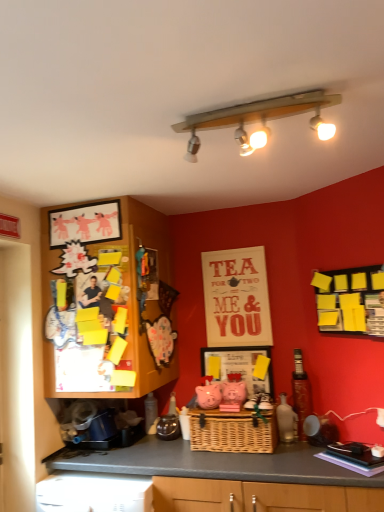
Locate an element on the screen. The height and width of the screenshot is (512, 384). yellow sticky notes at upper right is located at coordinates (351, 300).

Where is `wooden cabinet at left`? Image resolution: width=384 pixels, height=512 pixels. wooden cabinet at left is located at coordinates (106, 302).

Identify the location of woven brown basket at center. (232, 431).

Would you say wooden picture frame at upper left, which appears as the 1th picture frame when viewed from the top, is to the left or to the right of matte white picture frame at center, which ranks as the 2th picture frame in top-to-bottom order, in the picture?

wooden picture frame at upper left, which appears as the 1th picture frame when viewed from the top, is to the left of matte white picture frame at center, which ranks as the 2th picture frame in top-to-bottom order.

From their relative heights in the image, would you say wooden picture frame at upper left, which is the 2th picture frame from bottom to top, is taller or shorter than matte white picture frame at center, which is counted as the 1th picture frame, starting from the right?

In the image, wooden picture frame at upper left, which is the 2th picture frame from bottom to top, appears to be shorter than matte white picture frame at center, which is counted as the 1th picture frame, starting from the right.

Is wooden picture frame at upper left, acting as the first picture frame starting from the front, looking in the opposite direction of matte white picture frame at center, which ranks as the 2th picture frame in top-to-bottom order?

No, wooden picture frame at upper left, acting as the first picture frame starting from the front, is not facing away from matte white picture frame at center, which ranks as the 2th picture frame in top-to-bottom order.

Is woven brown basket at center far away from white plastic dishwasher at lower left?

No, woven brown basket at center is in close proximity to white plastic dishwasher at lower left.

Considering the relative sizes of woven brown basket at center and white plastic dishwasher at lower left in the image provided, is woven brown basket at center shorter than white plastic dishwasher at lower left?

Indeed, woven brown basket at center has a lesser height compared to white plastic dishwasher at lower left.

From a real-world perspective, between woven brown basket at center and white plastic dishwasher at lower left, who is vertically higher?

woven brown basket at center.

Can you confirm if woven brown basket at center is bigger than white plastic dishwasher at lower left?

No, woven brown basket at center is not bigger than white plastic dishwasher at lower left.

Which of these two, woven brown basket at center or shiny metallic bottle at right, is wider?

woven brown basket at center.

Is woven brown basket at center not inside shiny metallic bottle at right?

woven brown basket at center is positioned outside shiny metallic bottle at right.

How distant is woven brown basket at center from shiny metallic bottle at right?

The distance of woven brown basket at center from shiny metallic bottle at right is 13.74 inches.

Based on their positions, is woven brown basket at center located to the left or right of shiny metallic bottle at right?

Clearly, woven brown basket at center is on the left of shiny metallic bottle at right in the image.

Which object is closer to the camera, shiny metallic bottle at right or wooden cabinet at left?

wooden cabinet at left.

From a real-world perspective, is shiny metallic bottle at right above or below wooden cabinet at left?

shiny metallic bottle at right is situated lower than wooden cabinet at left in the real world.

Can wooden cabinet at left be found inside shiny metallic bottle at right?

Actually, wooden cabinet at left is outside shiny metallic bottle at right.

From the image's perspective, which one is positioned higher, shiny metallic bottle at right or wooden cabinet at left?

From the image's view, wooden cabinet at left is above.

Between wooden picture frame at upper left, the 2th picture frame from the back, and white plastic dishwasher at lower left, which one has smaller width?

wooden picture frame at upper left, the 2th picture frame from the back.

Which is less distant, (84, 208) or (93, 482)?

The point (93, 482) is closer.

Find the location of `the 2nd picture frame positioned above the white plastic dishwasher at lower left (from the image's perspective)`. the 2nd picture frame positioned above the white plastic dishwasher at lower left (from the image's perspective) is located at coordinates (85, 223).

From the image's perspective, who appears lower, woven brown basket at center or matte white picture frame at center, which appears as the first picture frame when viewed from the back?

woven brown basket at center, from the image's perspective.

Is matte white picture frame at center, which is counted as the 1th picture frame, starting from the right, at the back of woven brown basket at center?

That's not correct — woven brown basket at center is not looking away from matte white picture frame at center, which is counted as the 1th picture frame, starting from the right.

Which object is closer to the camera, woven brown basket at center or matte white picture frame at center, which is counted as the 1th picture frame, starting from the right?

woven brown basket at center.

How different are the orientations of matte white picture frame at center, which is counted as the 1th picture frame, starting from the right, and woven brown basket at center in degrees?

0.254 degrees separate the facing orientations of matte white picture frame at center, which is counted as the 1th picture frame, starting from the right, and woven brown basket at center.

Is matte white picture frame at center, arranged as the first picture frame when ordered from the bottom, wider or thinner than woven brown basket at center?

matte white picture frame at center, arranged as the first picture frame when ordered from the bottom, is thinner than woven brown basket at center.

Is matte white picture frame at center, which is counted as the 1th picture frame, starting from the right, inside the boundaries of woven brown basket at center, or outside?

matte white picture frame at center, which is counted as the 1th picture frame, starting from the right, lies outside woven brown basket at center.

In the scene shown: Measure the distance between matte white picture frame at center, which appears as the first picture frame when viewed from the back, and woven brown basket at center.

They are 11.63 inches apart.

You are a GUI agent. You are given a task and a screenshot of the screen. Output one action in this format:
    pyautogui.click(x=<x>, y=<y>)
    Task: Click on the picture frame in front of the matte white picture frame at center, which appears as the first picture frame when viewed from the back
    The image size is (384, 512).
    Given the screenshot: What is the action you would take?
    pyautogui.click(x=85, y=223)

Image resolution: width=384 pixels, height=512 pixels. In the image, there is a white plastic dishwasher at lower left. Identify the location of basket above it (from the image's perspective). (232, 431).

Based on their spatial positions, is white plastic dishwasher at lower left or matte white picture frame at center, which appears as the first picture frame when viewed from the back, closer to wooden with frosted glass lights at upper center?

matte white picture frame at center, which appears as the first picture frame when viewed from the back, is closer to wooden with frosted glass lights at upper center.

Which object lies nearer to the anchor point wooden cabinet at left, white plastic dishwasher at lower left or wooden with frosted glass lights at upper center?

Based on the image, white plastic dishwasher at lower left appears to be nearer to wooden cabinet at left.

Which object lies nearer to the anchor point shiny metallic bottle at right, woven brown basket at center or wooden picture frame at upper left, which appears as the 1th picture frame when viewed from the top?

woven brown basket at center.

Considering their positions, is shiny metallic bottle at right positioned closer to wooden picture frame at upper left, which appears as the 1th picture frame when viewed from the top, than woven brown basket at center?

Based on the image, woven brown basket at center appears to be nearer to wooden picture frame at upper left, which appears as the 1th picture frame when viewed from the top.

From the image, which object appears to be nearer to shiny metallic bottle at right, wooden picture frame at upper left, acting as the first picture frame starting from the front, or wooden cabinet at left?

wooden cabinet at left is closer to shiny metallic bottle at right.

Estimate the real-world distances between objects in this image. Which object is further from shiny metallic bottle at right, wooden picture frame at upper left, which is the 2th picture frame from bottom to top, or yellow sticky notes at upper right?

Based on the image, wooden picture frame at upper left, which is the 2th picture frame from bottom to top, appears to be further to shiny metallic bottle at right.

Estimate the real-world distances between objects in this image. Which object is closer to woven brown basket at center, yellow sticky notes at upper right or shiny metallic bottle at right?

Based on the image, shiny metallic bottle at right appears to be nearer to woven brown basket at center.

When comparing their distances from white plastic dishwasher at lower left, does matte white picture frame at center, placed as the second picture frame when sorted from left to right, or wooden with frosted glass lights at upper center seem closer?

matte white picture frame at center, placed as the second picture frame when sorted from left to right.

This screenshot has width=384, height=512. I want to click on cabinetry between wooden with frosted glass lights at upper center and wooden picture frame at upper left, acting as the first picture frame starting from the front, from front to back, so click(106, 302).

Where is `picture frame between yellow sticky notes at upper right and woven brown basket at center in the vertical direction`? The height and width of the screenshot is (512, 384). picture frame between yellow sticky notes at upper right and woven brown basket at center in the vertical direction is located at coordinates (238, 366).

You are a GUI agent. You are given a task and a screenshot of the screen. Output one action in this format:
    pyautogui.click(x=<x>, y=<y>)
    Task: Click on the cabinetry between wooden picture frame at upper left, which is the 2th picture frame from bottom to top, and yellow sticky notes at upper right
    The height and width of the screenshot is (512, 384).
    Given the screenshot: What is the action you would take?
    pyautogui.click(x=106, y=302)

In order to click on basket between wooden cabinet at left and yellow sticky notes at upper right from left to right in this screenshot , I will do pos(232,431).